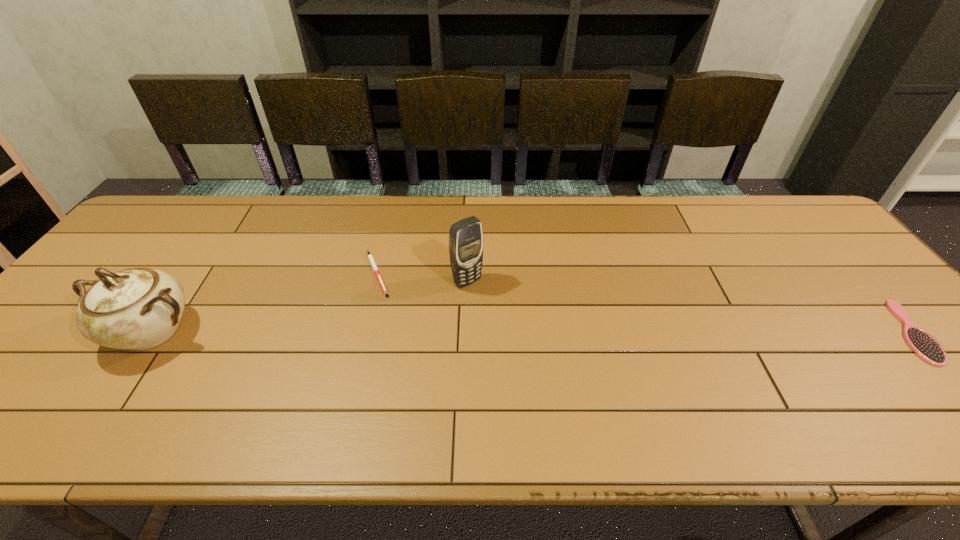
I want to click on vacant space at the far edge of the desktop, so click(x=595, y=198).

Identify the location of free space at the near edge. This screenshot has height=540, width=960. (224, 370).

This screenshot has height=540, width=960. What are the coordinates of `vacant space at the far right corner of the desktop` in the screenshot? It's located at (791, 197).

The height and width of the screenshot is (540, 960). Identify the location of free space at the near right corner of the desktop. (938, 399).

At what (x,y) coordinates should I click in order to perform the action: click on blank region between the second shortest object and the cellular telephone. Please return your answer as a coordinate pair (x, y). This screenshot has height=540, width=960. Looking at the image, I should click on (688, 307).

Locate an element on the screen. This screenshot has width=960, height=540. vacant point located between the cellular telephone and the rightmost object is located at coordinates (688, 307).

Identify the location of free space between the cellular telephone and the leftmost object. (309, 307).

You are a GUI agent. You are given a task and a screenshot of the screen. Output one action in this format:
    pyautogui.click(x=<x>, y=<y>)
    Task: Click on the unoccupied position between the cellular telephone and the pen
    Image resolution: width=960 pixels, height=540 pixels.
    Given the screenshot: What is the action you would take?
    pyautogui.click(x=422, y=278)

Locate an element on the screen. The image size is (960, 540). vacant area that lies between the pen and the leftmost object is located at coordinates (265, 302).

You are a GUI agent. You are given a task and a screenshot of the screen. Output one action in this format:
    pyautogui.click(x=<x>, y=<y>)
    Task: Click on the vacant area that lies between the pen and the rightmost object
    This screenshot has height=540, width=960.
    Given the screenshot: What is the action you would take?
    [643, 302]